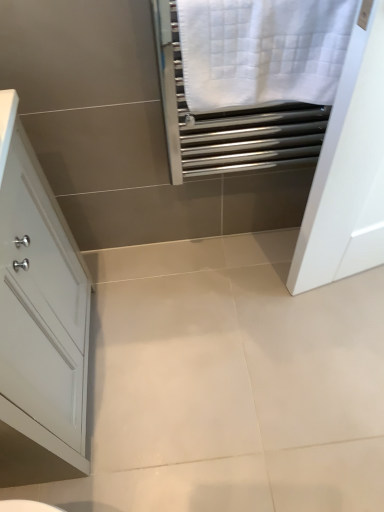
Question: Considering the relative sizes of white glossy cabinet at left and white textured towel at upper right in the image provided, is white glossy cabinet at left bigger than white textured towel at upper right?

Choices:
 (A) no
 (B) yes

Answer: (B)

Question: Is white glossy cabinet at left not within white textured towel at upper right?

Choices:
 (A) no
 (B) yes

Answer: (B)

Question: Are white glossy cabinet at left and white textured towel at upper right making contact?

Choices:
 (A) yes
 (B) no

Answer: (B)

Question: Could you tell me if white glossy cabinet at left is turned towards white textured towel at upper right?

Choices:
 (A) yes
 (B) no

Answer: (A)

Question: Is white glossy cabinet at left far from white textured towel at upper right?

Choices:
 (A) no
 (B) yes

Answer: (A)

Question: Does white glossy cabinet at left come behind white textured towel at upper right?

Choices:
 (A) no
 (B) yes

Answer: (A)

Question: Is white textured towel at upper right positioned behind white glossy cabinet at left?

Choices:
 (A) yes
 (B) no

Answer: (A)

Question: Is white textured towel at upper right positioned with its back to white glossy cabinet at left?

Choices:
 (A) yes
 (B) no

Answer: (B)

Question: Is white textured towel at upper right thinner than white glossy cabinet at left?

Choices:
 (A) yes
 (B) no

Answer: (A)

Question: Can you confirm if white textured towel at upper right is smaller than white glossy cabinet at left?

Choices:
 (A) no
 (B) yes

Answer: (B)

Question: Considering the relative sizes of white textured towel at upper right and white glossy cabinet at left in the image provided, is white textured towel at upper right bigger than white glossy cabinet at left?

Choices:
 (A) no
 (B) yes

Answer: (A)

Question: Is white glossy cabinet at left completely or partially inside white textured towel at upper right?

Choices:
 (A) yes
 (B) no

Answer: (B)

Question: From the image's perspective, is white glossy cabinet at left above or below white textured towel at upper right?

Choices:
 (A) above
 (B) below

Answer: (B)